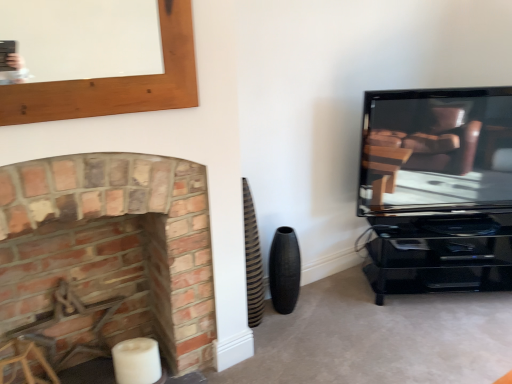
Question: Can we say black textured vase at lower center lies outside brick fireplace at left?

Choices:
 (A) no
 (B) yes

Answer: (B)

Question: Is brick fireplace at left inside black textured vase at lower center?

Choices:
 (A) no
 (B) yes

Answer: (A)

Question: Can you confirm if black textured vase at lower center is shorter than brick fireplace at left?

Choices:
 (A) no
 (B) yes

Answer: (B)

Question: Can you confirm if black textured vase at lower center is bigger than brick fireplace at left?

Choices:
 (A) no
 (B) yes

Answer: (A)

Question: Considering the relative sizes of black textured vase at lower center and brick fireplace at left in the image provided, is black textured vase at lower center smaller than brick fireplace at left?

Choices:
 (A) yes
 (B) no

Answer: (A)

Question: Is brick fireplace at left to the left or to the right of metallic brown swivel chair at left in the image?

Choices:
 (A) right
 (B) left

Answer: (A)

Question: Considering the positions of point (138, 263) and point (69, 302), is point (138, 263) closer or farther from the camera than point (69, 302)?

Choices:
 (A) farther
 (B) closer

Answer: (A)

Question: Considering the positions of brick fireplace at left and metallic brown swivel chair at left in the image, is brick fireplace at left bigger or smaller than metallic brown swivel chair at left?

Choices:
 (A) small
 (B) big

Answer: (B)

Question: From the image's perspective, is brick fireplace at left above or below metallic brown swivel chair at left?

Choices:
 (A) below
 (B) above

Answer: (B)

Question: Relative to black textured vase at lower center, is brick fireplace at left in front or behind?

Choices:
 (A) front
 (B) behind

Answer: (A)

Question: Considering the positions of brick fireplace at left and black textured vase at lower center in the image, is brick fireplace at left wider or thinner than black textured vase at lower center?

Choices:
 (A) thin
 (B) wide

Answer: (B)

Question: From a real-world perspective, relative to black textured vase at lower center, is brick fireplace at left vertically above or below?

Choices:
 (A) above
 (B) below

Answer: (A)

Question: Do you think brick fireplace at left is within black textured vase at lower center, or outside of it?

Choices:
 (A) outside
 (B) inside

Answer: (A)

Question: From a real-world perspective, is brick fireplace at left above or below matte black tv at right?

Choices:
 (A) above
 (B) below

Answer: (B)

Question: From the image's perspective, is brick fireplace at left positioned above or below matte black tv at right?

Choices:
 (A) above
 (B) below

Answer: (B)